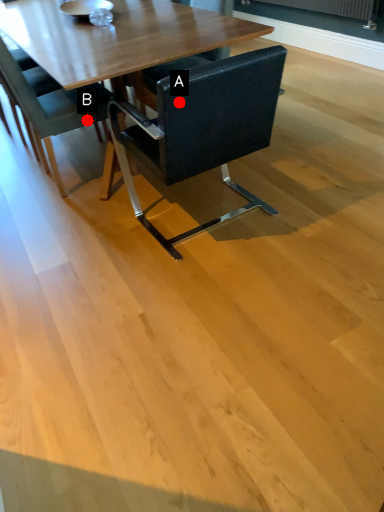
Question: Two points are circled on the image, labeled by A and B beside each circle. Among these points, which one is farthest from the camera?

Choices:
 (A) A is further
 (B) B is further

Answer: (B)